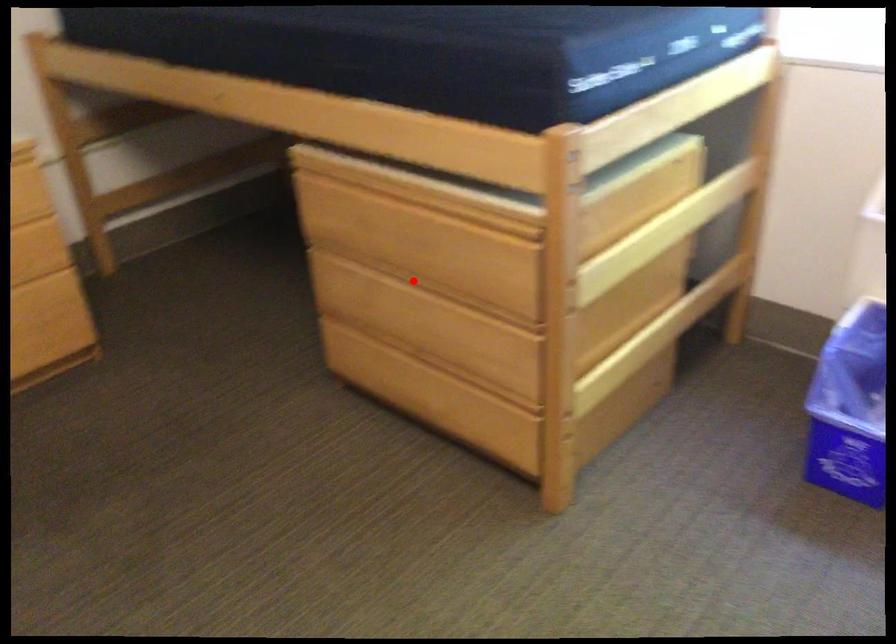
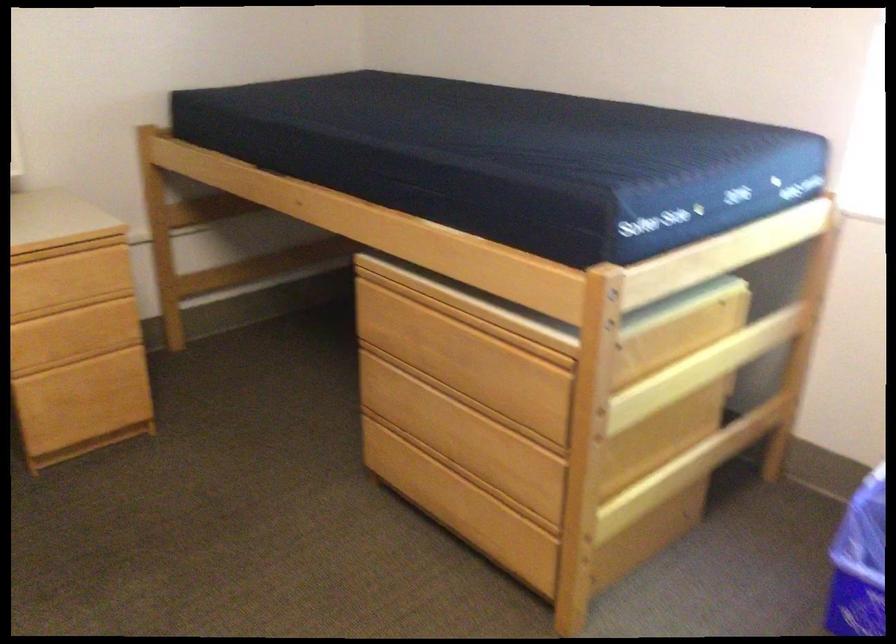
The point at the highlighted location is marked in the first image. Where is the corresponding point in the second image?

(452, 392)